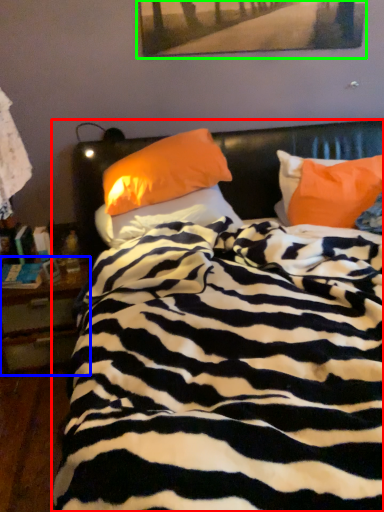
Question: Estimate the real-world distances between objects in this image. Which object is farther from bed (highlighted by a red box), nightstand (highlighted by a blue box) or picture frame (highlighted by a green box)?

Choices:
 (A) nightstand
 (B) picture frame

Answer: (B)